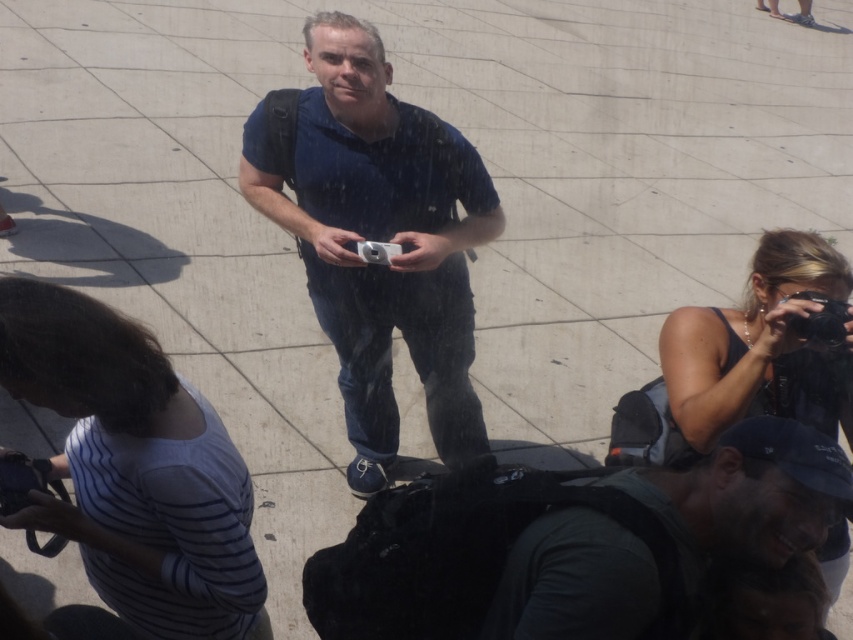
Can you confirm if dark green fabric backpack at lower center is smaller than black rubber camera at upper right?

No, dark green fabric backpack at lower center is not smaller than black rubber camera at upper right.

Who is lower down, dark green fabric backpack at lower center or black rubber camera at upper right?

dark green fabric backpack at lower center is lower down.

Is point (827, 492) farther from viewer compared to point (817, 324)?

No, it is in front of (817, 324).

I want to click on dark green fabric backpack at lower center, so click(747, 493).

Is white striped shirt at lower left above black rubber camera at upper right?

No.

Who is higher up, white striped shirt at lower left or black rubber camera at upper right?

black rubber camera at upper right is above.

Between point (59, 355) and point (811, 326), which one is positioned in front?

Point (59, 355) is in front.

Locate an element on the screen. The image size is (853, 640). white striped shirt at lower left is located at coordinates (135, 468).

Is blue cotton shirt at center behind silver metallic camera at center?

No, blue cotton shirt at center is in front of silver metallic camera at center.

I want to click on blue cotton shirt at center, so click(380, 240).

Does point (440, 305) lie behind point (360, 253)?

Yes, it is.

Identify the location of blue cotton shirt at center. This screenshot has height=640, width=853. (x=380, y=240).